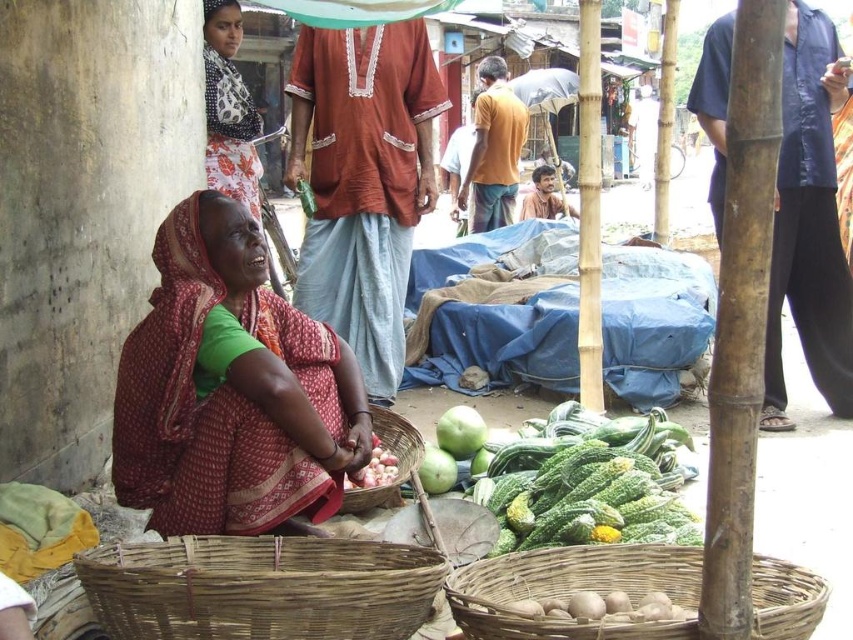
You are standing at the origin point of the coordinate system in the market scene. The woman in the red and white sari is at position 0.0, 0.0. Where is the matte orange shirt at center located relative to her?

The matte orange shirt at center is located at coordinates (x=363, y=180) relative to the woman in the red and white sari at (x=0, y=0).